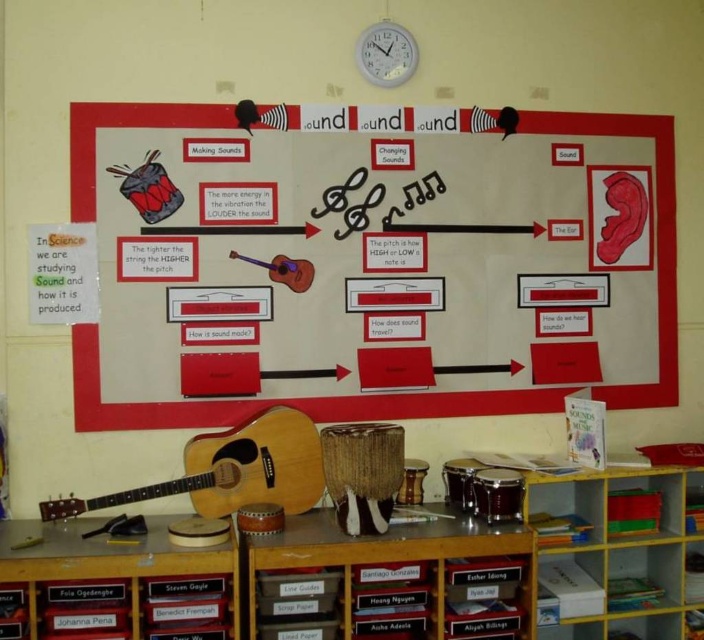
Does matte white paper at center have a lesser height compared to natural wood acoustic guitar at lower left?

No.

Is matte white paper at center bigger than natural wood acoustic guitar at lower left?

Yes, matte white paper at center is bigger than natural wood acoustic guitar at lower left.

Is point (647, 401) behind point (291, 444)?

That is True.

Image resolution: width=704 pixels, height=640 pixels. Identify the location of matte white paper at center. (279, 401).

Identify the location of matte white paper at center. The width and height of the screenshot is (704, 640). (279, 401).

Which is in front, point (677, 349) or point (282, 282)?

Positioned in front is point (282, 282).

The height and width of the screenshot is (640, 704). Describe the element at coordinates (279, 401) in the screenshot. I see `matte white paper at center` at that location.

The height and width of the screenshot is (640, 704). Identify the location of matte white paper at center. (279, 401).

Can you confirm if gray plastic clock at upper center is smaller than matte brown guitar at center?

No.

Find the location of a particular element. This screenshot has height=640, width=704. gray plastic clock at upper center is located at coordinates (386, 52).